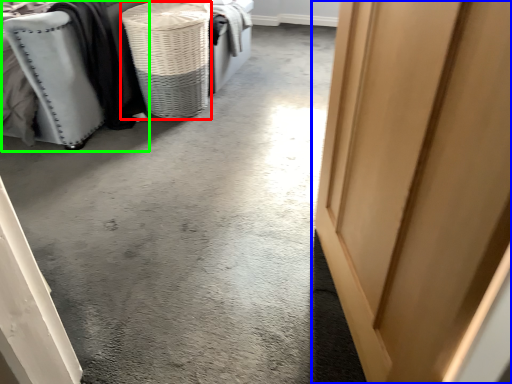
Question: Which object is the closest to the basket (highlighted by a red box)? Choose among these: door (highlighted by a blue box) or furniture (highlighted by a green box).

Choices:
 (A) door
 (B) furniture

Answer: (B)